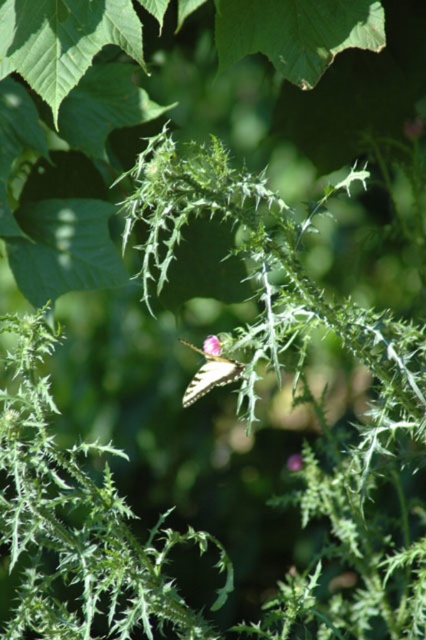
Between point (213, 376) and point (210, 352), which one is positioned in front?

Point (213, 376)

Between yellow matte butterfly at center and smooth pink flower at center, which one is positioned lower?

yellow matte butterfly at center

Measure the distance between point (236, 369) and camera.

Point (236, 369) and camera are 5.77 feet apart.

The image size is (426, 640). Find the location of `yellow matte butterfly at center`. yellow matte butterfly at center is located at coordinates (210, 371).